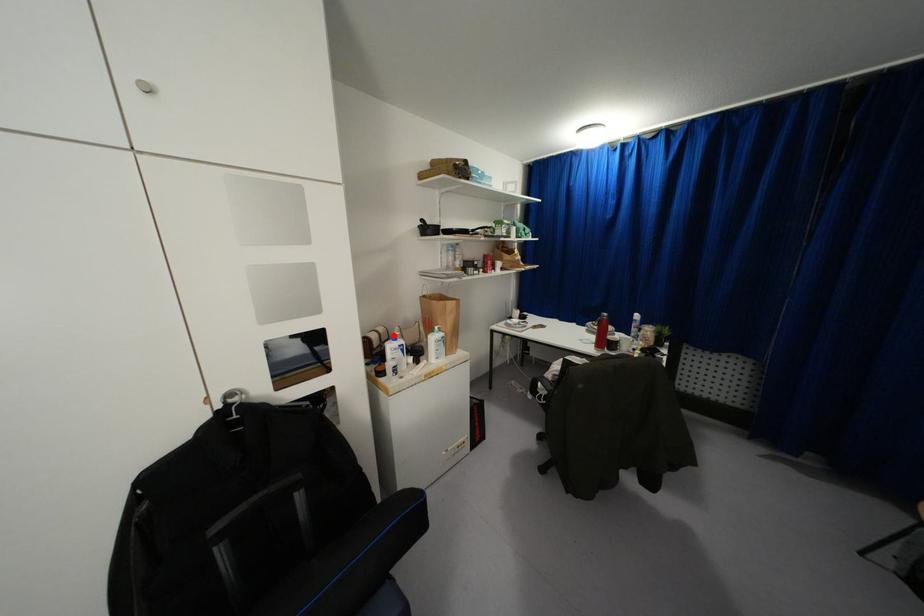
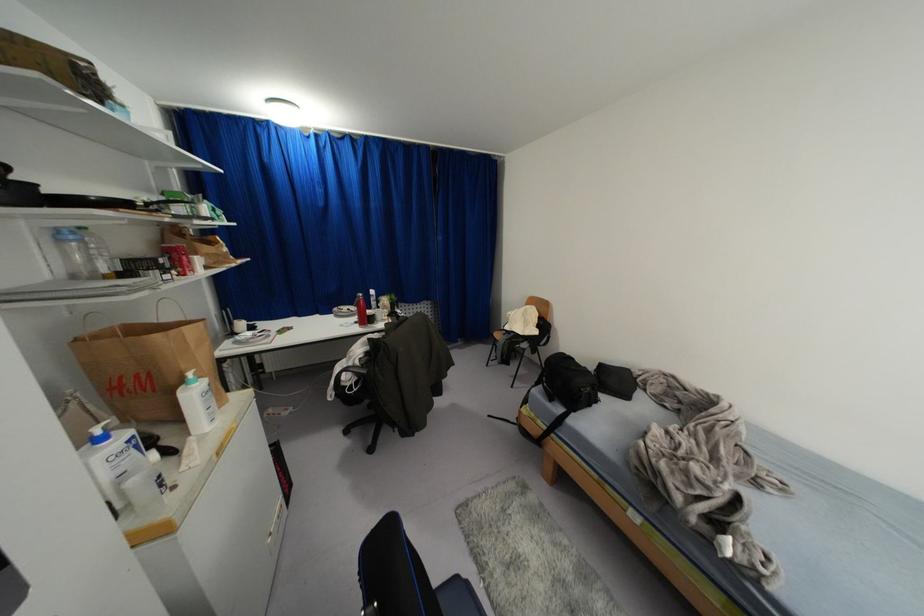
Question: I am providing you with two images of the same scene from different viewpoints. Given a red point in image1, look at the same physical point in image2. Is it:

Choices:
 (A) Closer to the viewpoint
 (B) Farther from the viewpoint

Answer: (B)